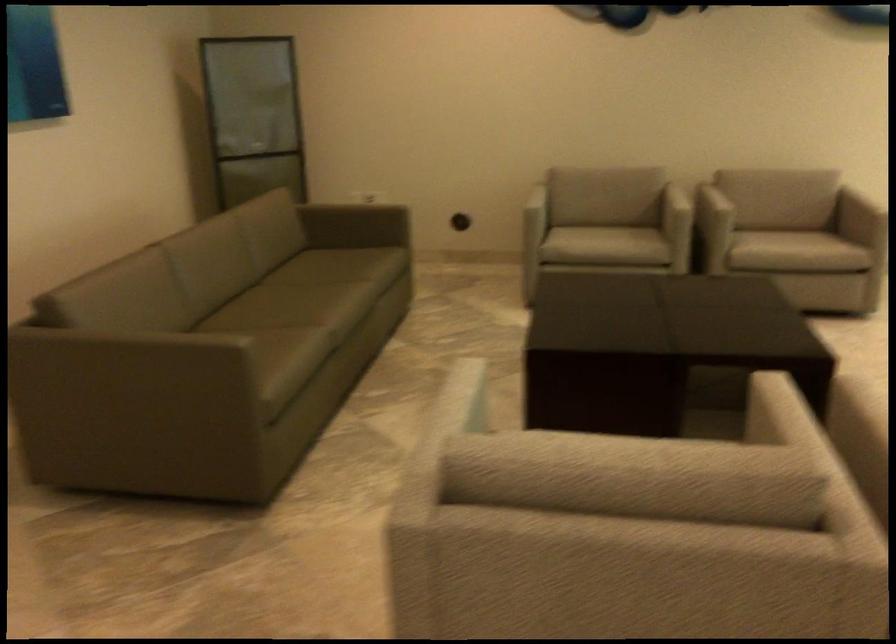
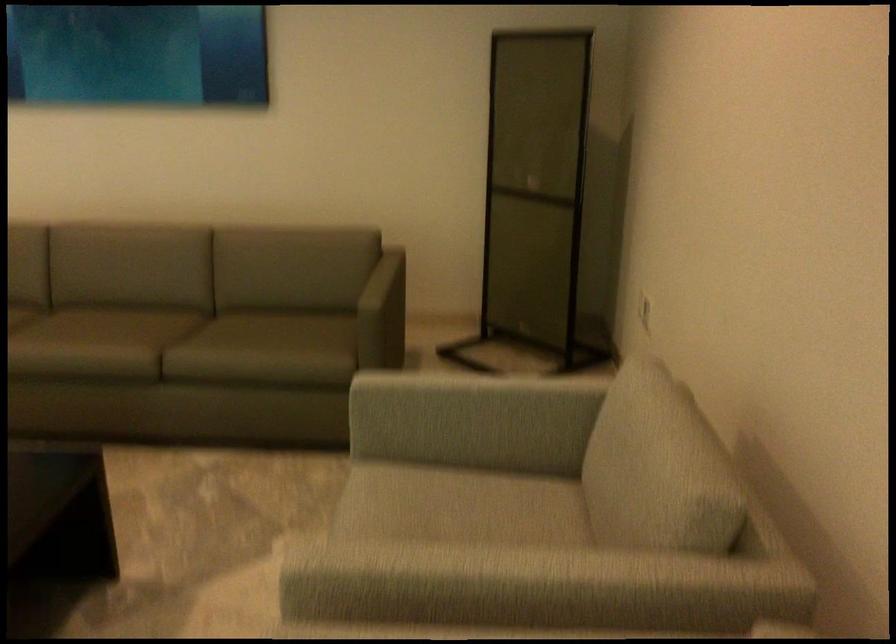
In the second image, find the point that corresponds to (x=536, y=194) in the first image.

(469, 399)